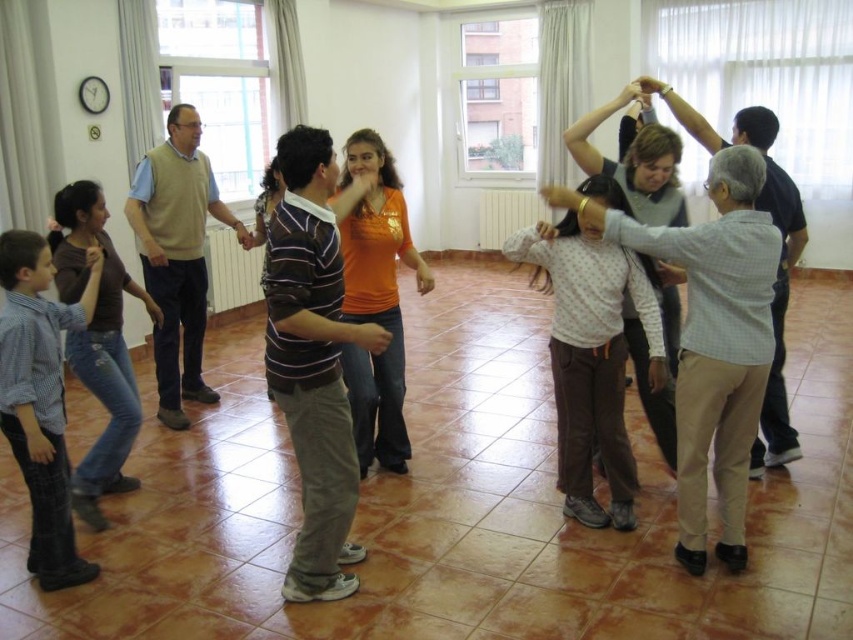
You are standing at the entrance of the room and want to find the beige sweater at center. According to the coordinates provided, in which direction should you move to locate it?

The beige sweater at center is located at coordinates point 0.400 on the x axis and 0.209 on the y axis. Since you are at the entrance, you should move towards the center of the room to find it.

You are organizing a photo shoot and need to ensure that the beige sweater at center and the checkered fabric shirt at upper right can fit side by side on a backdrop. The backdrop is 1.2 meters wide. Can both items fit without overlapping?

The beige sweater at center is narrower than the checkered fabric shirt at upper right. However, since the total width of both items combined is not provided, it is impossible to determine if they can fit on the 1.2 meter backdrop without overlapping. Additional information about their individual widths is needed to make an accurate assessment.

You are at a social event and want to greet the person wearing the checkered fabric shirt at upper right. Since the beige sweater at center is blocking your view, can you walk around them to get closer?

The checkered fabric shirt at upper right is behind the beige sweater at center, so you can walk around the beige sweater at center to get closer to the checkered fabric shirt at upper right.